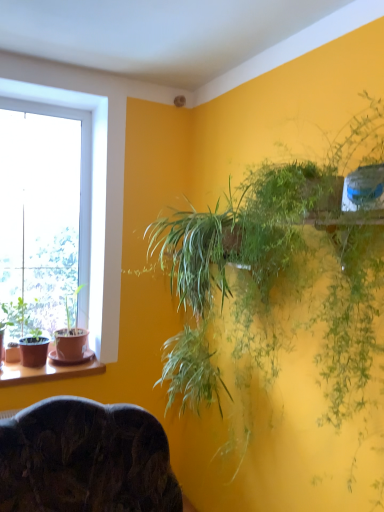
You are a GUI agent. You are given a task and a screenshot of the screen. Output one action in this format:
    pyautogui.click(x=<x>, y=<y>)
    Task: Click on the green matte pot at left, the second houseplant when ordered from front to back
    
    Given the screenshot: What is the action you would take?
    pyautogui.click(x=33, y=348)

Describe the element at coordinates (33, 348) in the screenshot. The image size is (384, 512). I see `green matte pot at left, which appears as the 1th houseplant when viewed from the left` at that location.

Find the location of a particular element. transparent glass window at left is located at coordinates (92, 179).

The image size is (384, 512). I want to click on brown wooden window sill at lower left, so click(48, 371).

From the picture: Is green matte pot at left, arranged as the second houseplant when viewed from the back, bigger than brown wooden window sill at lower left?

Yes, green matte pot at left, arranged as the second houseplant when viewed from the back, is bigger than brown wooden window sill at lower left.

Is green matte pot at left, the second houseplant when ordered from front to back, closer to the viewer compared to brown wooden window sill at lower left?

No.

The image size is (384, 512). I want to click on window sill that appears below the green matte pot at left, arranged as the second houseplant when viewed from the back (from the image's perspective), so click(x=48, y=371).

Between green matte pot at left, which appears as the 3th houseplant when viewed from the right, and brown wooden window sill at lower left, which one appears on the right side from the viewer's perspective?

Positioned to the right is brown wooden window sill at lower left.

Which object is more forward, dark wood chair at lower center or matte brown pot at left, which appears as the second houseplant when viewed from the right?

Positioned in front is dark wood chair at lower center.

Measure the distance between dark wood chair at lower center and matte brown pot at left, arranged as the second houseplant when viewed from the left.

dark wood chair at lower center is 33.75 inches away from matte brown pot at left, arranged as the second houseplant when viewed from the left.

Looking at this image, considering the positions of objects dark wood chair at lower center and matte brown pot at left, which ranks as the 3th houseplant in front-to-back order, in the image provided, who is more to the left, dark wood chair at lower center or matte brown pot at left, which ranks as the 3th houseplant in front-to-back order,?

Positioned to the left is matte brown pot at left, which ranks as the 3th houseplant in front-to-back order.

Considering the sizes of objects dark wood chair at lower center and matte brown pot at left, which appears as the second houseplant when viewed from the right, in the image provided, who is wider, dark wood chair at lower center or matte brown pot at left, which appears as the second houseplant when viewed from the right,?

With larger width is dark wood chair at lower center.

What's the angular difference between transparent glass window at left and green leafy plant at upper right, the 1th houseplant positioned from the front,'s facing directions?

90.3 degrees.

Does point (36, 93) come behind point (183, 121)?

No, (36, 93) is in front of (183, 121).

Looking at this image, is transparent glass window at left oriented towards green leafy plant at upper right, which ranks as the 3th houseplant in back-to-front order?

Yes, transparent glass window at left is aimed at green leafy plant at upper right, which ranks as the 3th houseplant in back-to-front order.

Based on the photo, from a real-world perspective, is transparent glass window at left above or below green leafy plant at upper right, the 1th houseplant positioned from the front?

From a real-world perspective, transparent glass window at left is physically above green leafy plant at upper right, the 1th houseplant positioned from the front.

Choose the correct answer: Is matte brown pot at left, which ranks as the 3th houseplant in front-to-back order, inside green matte pot at left, which appears as the 1th houseplant when viewed from the left, or outside it?

The correct answer is: outside.

How much distance is there between matte brown pot at left, which appears as the second houseplant when viewed from the right, and green matte pot at left, which appears as the 3th houseplant when viewed from the right?

The distance of matte brown pot at left, which appears as the second houseplant when viewed from the right, from green matte pot at left, which appears as the 3th houseplant when viewed from the right, is 5.78 inches.

Is point (72, 358) closer or farther from the camera than point (23, 338)?

Point (72, 358) is positioned farther from the camera compared to point (23, 338).

Is matte brown pot at left, the first houseplant from the back, with green matte pot at left, the second houseplant when ordered from front to back?

matte brown pot at left, the first houseplant from the back, and green matte pot at left, the second houseplant when ordered from front to back, are not in contact.

From the image's perspective, is green leafy plant at upper right, which ranks as the 3th houseplant in back-to-front order, located above or below green matte pot at left, which appears as the 3th houseplant when viewed from the right?

Clearly, from the image's perspective, green leafy plant at upper right, which ranks as the 3th houseplant in back-to-front order, is above green matte pot at left, which appears as the 3th houseplant when viewed from the right.

Which is closer, (x=180, y=136) or (x=47, y=343)?

The point (x=47, y=343) is closer.

Choose the correct answer: Is green leafy plant at upper right, the 1th houseplant positioned from the front, inside green matte pot at left, which appears as the 3th houseplant when viewed from the right, or outside it?

green leafy plant at upper right, the 1th houseplant positioned from the front, is not inside green matte pot at left, which appears as the 3th houseplant when viewed from the right, it's outside.

Consider the image. Can you confirm if green leafy plant at upper right, the 1th houseplant viewed from the right, is positioned to the left of green matte pot at left, which appears as the 3th houseplant when viewed from the right?

Incorrect, green leafy plant at upper right, the 1th houseplant viewed from the right, is not on the left side of green matte pot at left, which appears as the 3th houseplant when viewed from the right.

Is transparent glass window at left next to green matte pot at left, arranged as the second houseplant when viewed from the back?

No, transparent glass window at left is not in contact with green matte pot at left, arranged as the second houseplant when viewed from the back.

Consider the image. Which point is more forward, (x=35, y=92) or (x=36, y=327)?

The point (x=35, y=92) is closer to the camera.

Is transparent glass window at left inside the boundaries of green matte pot at left, the second houseplant when ordered from front to back, or outside?

transparent glass window at left lies outside green matte pot at left, the second houseplant when ordered from front to back.

Considering the relative sizes of transparent glass window at left and green matte pot at left, the second houseplant when ordered from front to back, in the image provided, is transparent glass window at left taller than green matte pot at left, the second houseplant when ordered from front to back,?

Indeed, transparent glass window at left has a greater height compared to green matte pot at left, the second houseplant when ordered from front to back.

From a real-world perspective, which object rests below the other?

In real-world perspective, green matte pot at left, which appears as the 1th houseplant when viewed from the left, is lower.

Does point (25, 347) lie in front of point (91, 300)?

That is True.

Measure the distance between green matte pot at left, the second houseplant when ordered from front to back, and transparent glass window at left.

green matte pot at left, the second houseplant when ordered from front to back, is 21.06 inches away from transparent glass window at left.

Find the location of a particular element. houseplant on the left of the brown wooden window sill at lower left is located at coordinates (33, 348).

Locate an element on the screen. the 3rd houseplant behind when counting from the dark wood chair at lower center is located at coordinates (70, 341).

From the image, which object appears to be nearer to green matte pot at left, which appears as the 3th houseplant when viewed from the right, transparent glass window at left or matte brown pot at left, which appears as the second houseplant when viewed from the right?

The object closer to green matte pot at left, which appears as the 3th houseplant when viewed from the right, is matte brown pot at left, which appears as the second houseplant when viewed from the right.

Estimate the real-world distances between objects in this image. Which object is further from brown wooden window sill at lower left, green leafy plant at upper right, the 1th houseplant viewed from the right, or matte brown pot at left, arranged as the second houseplant when viewed from the left?

green leafy plant at upper right, the 1th houseplant viewed from the right, is positioned further to the anchor brown wooden window sill at lower left.

Looking at the image, which one is located closer to transparent glass window at left, green leafy plant at upper right, the 1th houseplant viewed from the right, or dark wood chair at lower center?

green leafy plant at upper right, the 1th houseplant viewed from the right, is closer to transparent glass window at left.

Estimate the real-world distances between objects in this image. Which object is closer to green matte pot at left, which appears as the 3th houseplant when viewed from the right, transparent glass window at left or dark wood chair at lower center?

transparent glass window at left is closer to green matte pot at left, which appears as the 3th houseplant when viewed from the right.

Considering their positions, is dark wood chair at lower center positioned closer to matte brown pot at left, which ranks as the 3th houseplant in front-to-back order, than green leafy plant at upper right, the 1th houseplant viewed from the right?

dark wood chair at lower center is positioned closer to the anchor matte brown pot at left, which ranks as the 3th houseplant in front-to-back order.

From the image, which object appears to be farther from brown wooden window sill at lower left, dark wood chair at lower center or green matte pot at left, which appears as the 1th houseplant when viewed from the left?

dark wood chair at lower center is positioned further to the anchor brown wooden window sill at lower left.

Based on their spatial positions, is matte brown pot at left, which ranks as the 3th houseplant in front-to-back order, or dark wood chair at lower center further from green leafy plant at upper right, the third houseplant from the left?

Based on the image, dark wood chair at lower center appears to be further to green leafy plant at upper right, the third houseplant from the left.

Estimate the real-world distances between objects in this image. Which object is closer to transparent glass window at left, brown wooden window sill at lower left or dark wood chair at lower center?

brown wooden window sill at lower left is closer to transparent glass window at left.

Locate an element on the screen. Image resolution: width=384 pixels, height=512 pixels. window sill between green leafy plant at upper right, the third houseplant from the left, and transparent glass window at left, along the z-axis is located at coordinates (48, 371).

The width and height of the screenshot is (384, 512). What are the coordinates of `houseplant located between dark wood chair at lower center and brown wooden window sill at lower left in the depth direction` in the screenshot? It's located at (358, 127).

Identify the location of houseplant located between green leafy plant at upper right, the third houseplant from the left, and matte brown pot at left, arranged as the second houseplant when viewed from the left, in the depth direction. (33, 348).

Where is `window sill between dark wood chair at lower center and transparent glass window at left along the z-axis`? window sill between dark wood chair at lower center and transparent glass window at left along the z-axis is located at coordinates (48, 371).